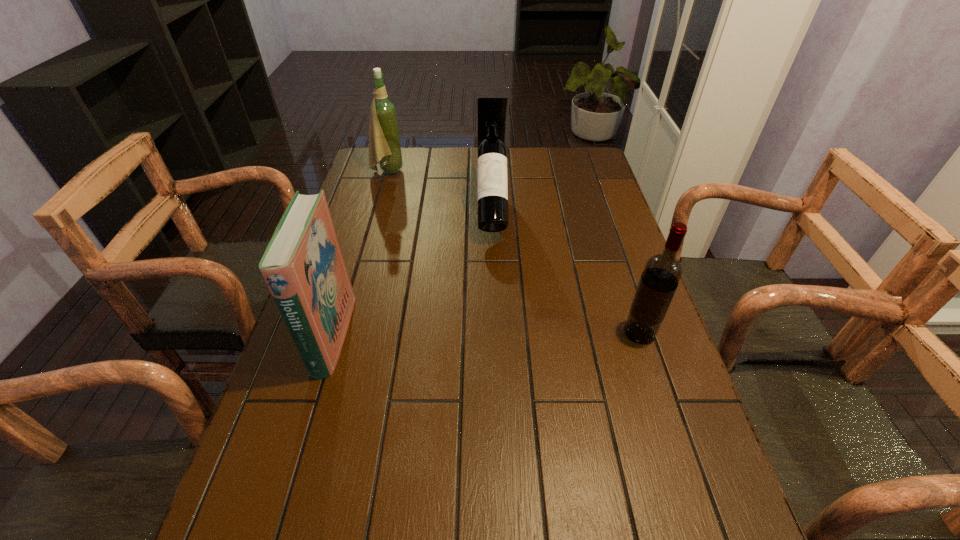
The height and width of the screenshot is (540, 960). I want to click on vacant area that lies between the second object from right to left and the hardback book, so click(413, 273).

Find the location of `free area in between the nearest wine bottle and the leftmost wine bottle`. free area in between the nearest wine bottle and the leftmost wine bottle is located at coordinates (514, 252).

You are a GUI agent. You are given a task and a screenshot of the screen. Output one action in this format:
    pyautogui.click(x=<x>, y=<y>)
    Task: Click on the unoccupied area between the farthest object and the hardback book
    The image size is (960, 540).
    Given the screenshot: What is the action you would take?
    pyautogui.click(x=361, y=253)

Where is `the closest object to the nearest wine bottle`? The image size is (960, 540). the closest object to the nearest wine bottle is located at coordinates (492, 170).

Locate which object is the closest to the farthest object. Please provide its 2D coordinates. Your answer should be formatted as a tuple, i.e. [(x, y)], where the tuple contains the x and y coordinates of a point satisfying the conditions above.

[(492, 170)]

Identify the location of the second closest wine bottle to the third object from left to right. This screenshot has height=540, width=960. (662, 272).

Identify which wine bottle is located as the second nearest to the nearest wine bottle. Please provide its 2D coordinates. Your answer should be formatted as a tuple, i.e. [(x, y)], where the tuple contains the x and y coordinates of a point satisfying the conditions above.

[(384, 141)]

What are the coordinates of `vacant space that satisfies the following two spatial constraints: 1. on the stand of the second farthest wine bottle; 2. on the cover of the hardback book` in the screenshot? It's located at (495, 335).

At what (x,y) coordinates should I click in order to perform the action: click on vacant position in the image that satisfies the following two spatial constraints: 1. on the stand of the rightmost wine bottle; 2. on the right side of the second farthest wine bottle. Please return your answer as a coordinate pair (x, y). The image size is (960, 540). Looking at the image, I should click on (495, 333).

Locate an element on the screen. Image resolution: width=960 pixels, height=540 pixels. free location that satisfies the following two spatial constraints: 1. on the front-facing side of the leftmost wine bottle; 2. on the back side of the nearest wine bottle is located at coordinates (342, 333).